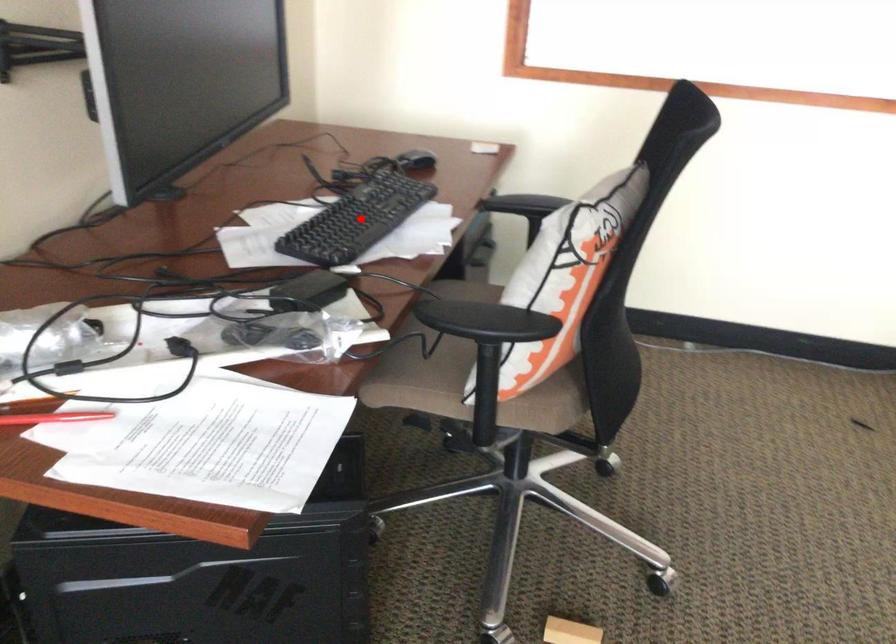
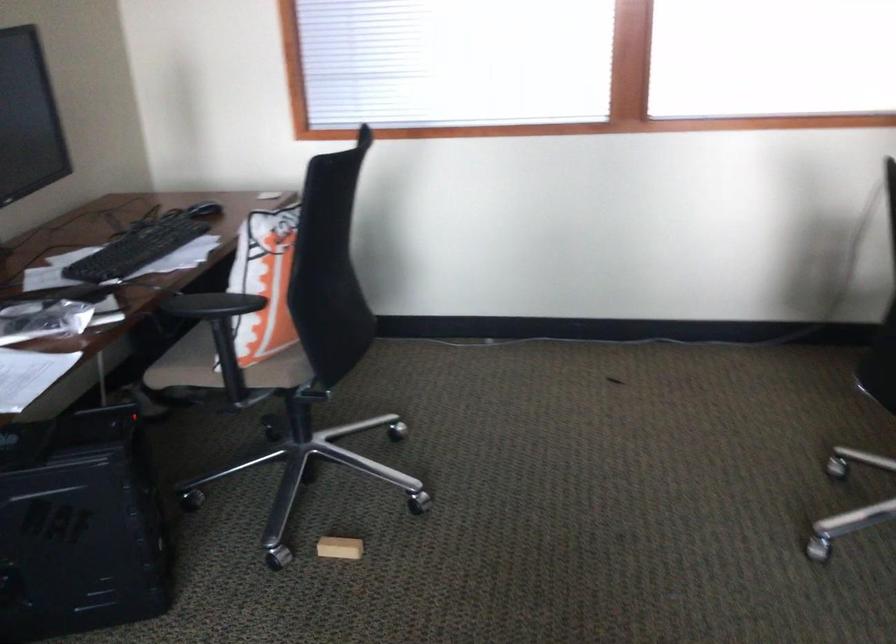
Find the pixel in the second image that matches the highlighted location in the first image.

(138, 248)